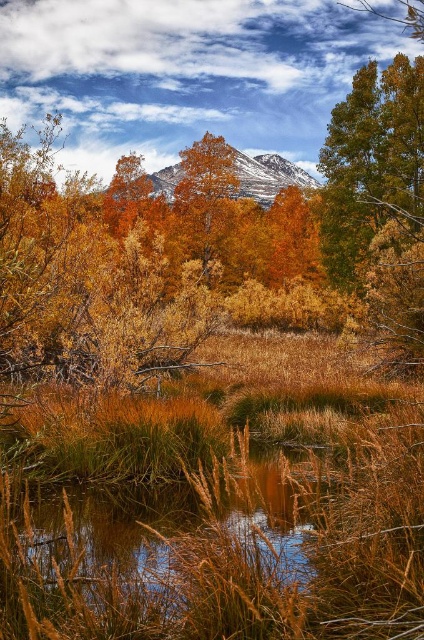
Question: Which point is closer to the camera?

Choices:
 (A) snowy rock mountain at upper center
 (B) golden textured tree at center

Answer: (B)

Question: Can you confirm if golden textured tree at center is positioned below snowy rock mountain at upper center?

Choices:
 (A) yes
 (B) no

Answer: (A)

Question: Is golden textured tree at center bigger than snowy rock mountain at upper center?

Choices:
 (A) yes
 (B) no

Answer: (B)

Question: Can you confirm if golden textured tree at center is smaller than snowy rock mountain at upper center?

Choices:
 (A) no
 (B) yes

Answer: (B)

Question: Which object is farther from the camera taking this photo?

Choices:
 (A) golden textured tree at center
 (B) snowy rock mountain at upper center

Answer: (B)